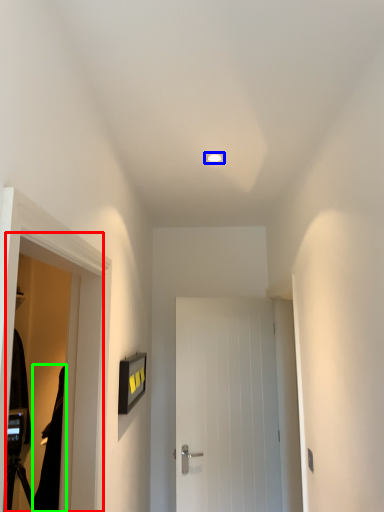
Question: Considering the real-world distances, which object is farthest from screen door (highlighted by a red box)? lighting (highlighted by a blue box) or robe (highlighted by a green box)?

Choices:
 (A) lighting
 (B) robe

Answer: (A)